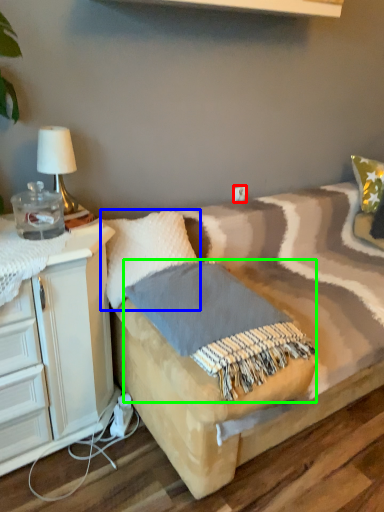
Question: Estimate the real-world distances between objects in this image. Which object is farther from electric outlet (highlighted by a red box), pillow (highlighted by a blue box) or blanket (highlighted by a green box)?

Choices:
 (A) pillow
 (B) blanket

Answer: (B)